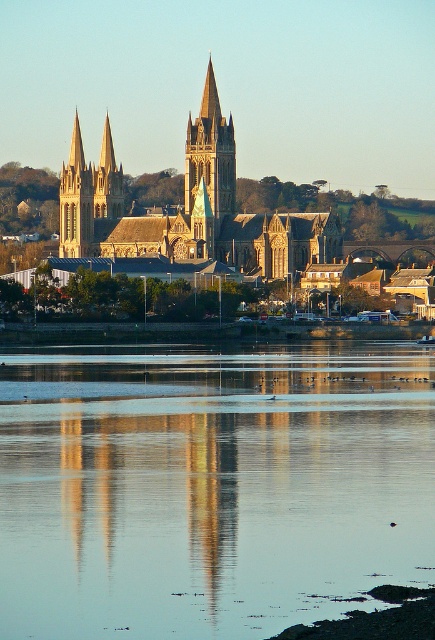
You are an architect examining the riverside cathedral scene. You need to determine the spatial relationship between the silvery reflective water at center and the golden stone tower at center. Based on the scene, which object is positioned lower in the image?

The silvery reflective water at center is located below golden stone tower at center, so the silvery reflective water at center is positioned lower in the image.

You are standing on the riverside path and see the silvery reflective water at center and the golden stone church at center. Which object is positioned to the left?

The silvery reflective water at center is to the left of the golden stone church at center, so the silvery reflective water at center is positioned to the left.

You are a tourist standing at the riverside and want to take a photo that includes both the golden stone church at center and the golden stone tower at center. Given that your camera has a maximum zoom range of 10 feet, can you capture both objects in a single frame without moving your position?

The golden stone church at center is 10.41 feet from the golden stone tower at center. Since the distance between them exceeds the camera maximum zoom range of 10 feet, you cannot capture both objects in a single frame without moving your position.